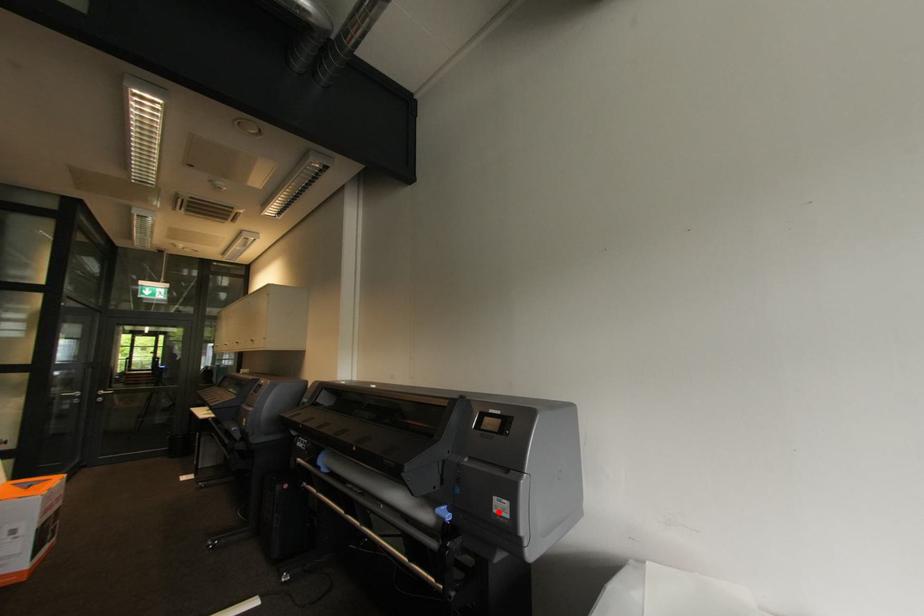
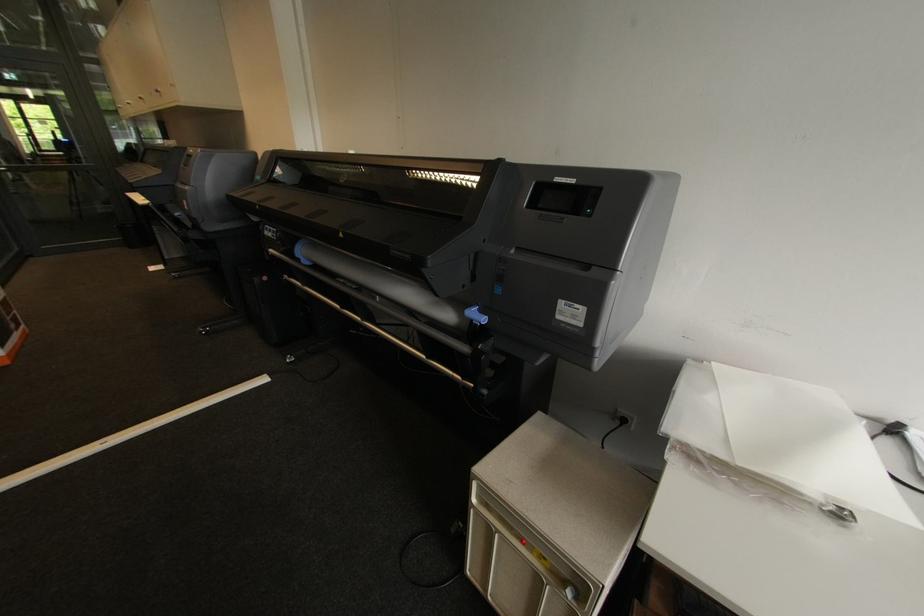
Where in the second image is the point corresponding to the highlighted location from the first image?

(563, 318)